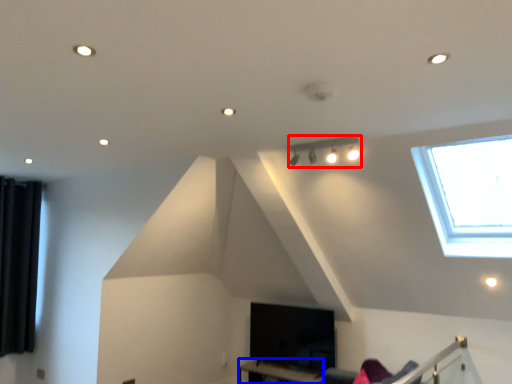
Question: Which point is closer to the camera, lamp (highlighted by a red box) or table (highlighted by a blue box)?

Choices:
 (A) lamp
 (B) table

Answer: (A)